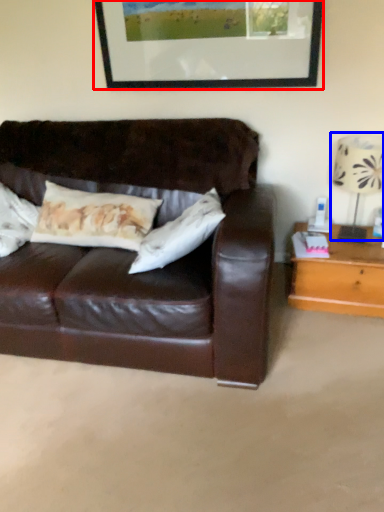
Question: Which of the following is the closest to the observer, picture frame (highlighted by a red box) or table lamp (highlighted by a blue box)?

Choices:
 (A) picture frame
 (B) table lamp

Answer: (B)